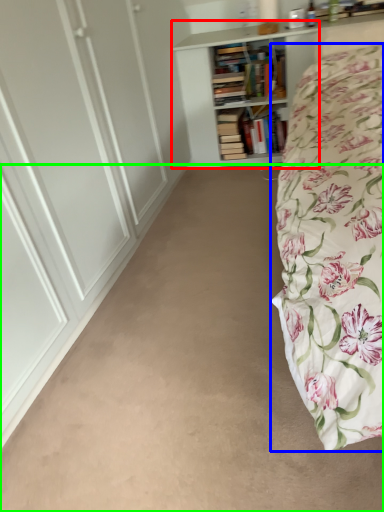
Question: Which object is the farthest from bookcase (highlighted by a red box)? Choose among these: bed (highlighted by a blue box) or plain (highlighted by a green box).

Choices:
 (A) bed
 (B) plain

Answer: (B)